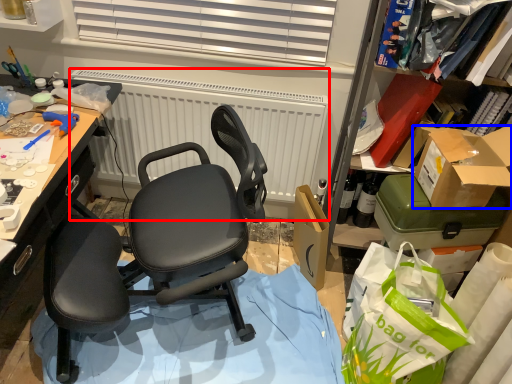
Question: Which point is further to the camera, radiator (highlighted by a red box) or box (highlighted by a blue box)?

Choices:
 (A) radiator
 (B) box

Answer: (A)